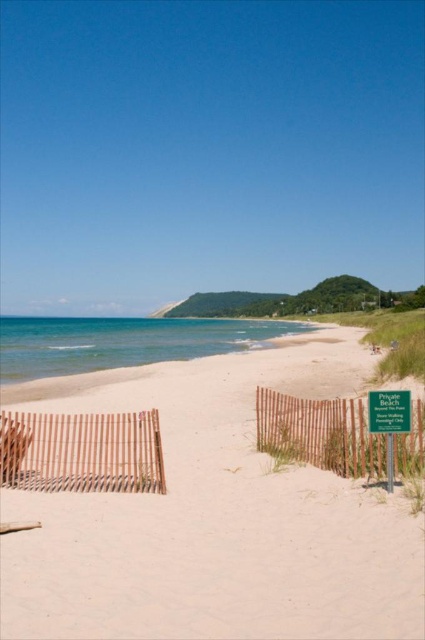
Question: Considering the relative positions of white sandy beach at center and brown wooden fence at lower right in the image provided, where is white sandy beach at center located with respect to brown wooden fence at lower right?

Choices:
 (A) above
 (B) below

Answer: (B)

Question: Which of the following is the farthest from the observer?

Choices:
 (A) brown wooden fence at lower left
 (B) brown wooden fence at lower right

Answer: (A)

Question: Which of the following is the farthest from the observer?

Choices:
 (A) (319, 612)
 (B) (28, 445)

Answer: (B)

Question: Does green plastic sign at lower right have a smaller size compared to wooden slats at lower left?

Choices:
 (A) no
 (B) yes

Answer: (B)

Question: In this image, where is white sandy beach at center located relative to wooden slats at lower left?

Choices:
 (A) left
 (B) right

Answer: (B)

Question: Among these points, which one is nearest to the camera?

Choices:
 (A) (396, 422)
 (B) (363, 464)
 (C) (286, 369)
 (D) (73, 452)

Answer: (A)